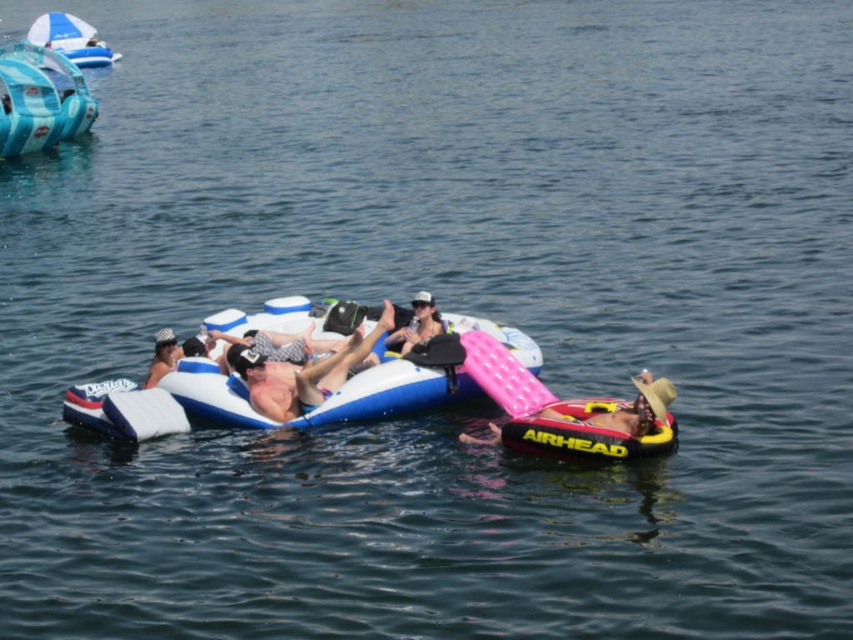
Question: Which object is closer to the camera taking this photo?

Choices:
 (A) matte white skin at center
 (B) pink inflatable float at lower right
 (C) matte blue floatie at center
 (D) blue inflatable raft at center

Answer: (B)

Question: Which is nearer to the matte blue floatie at center?

Choices:
 (A) blue inflatable raft at center
 (B) blue glossy umbrella at upper left

Answer: (A)

Question: Does blue inflatable boat at upper left come in front of matte white skin at center?

Choices:
 (A) no
 (B) yes

Answer: (A)

Question: Estimate the real-world distances between objects in this image. Which object is closer to the matte white skin at center?

Choices:
 (A) blue inflatable raft at center
 (B) pink inflatable float at lower right
 (C) matte blue floatie at center
 (D) blue inflatable boat at upper left

Answer: (C)

Question: Can you confirm if blue glossy umbrella at upper left is bigger than matte white skin at center?

Choices:
 (A) yes
 (B) no

Answer: (A)

Question: Does blue inflatable raft at center appear on the left side of matte black bag at center?

Choices:
 (A) no
 (B) yes

Answer: (B)